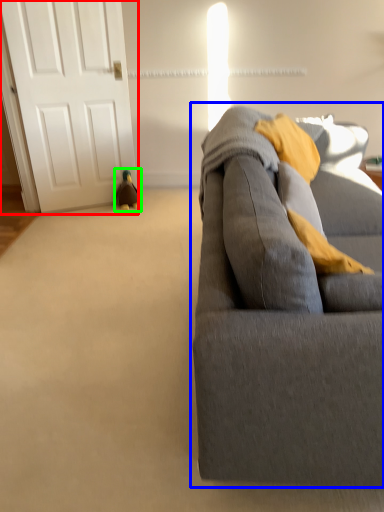
Question: Which is nearer to the door (highlighted by a red box)? studio couch (highlighted by a blue box) or toy (highlighted by a green box).

Choices:
 (A) studio couch
 (B) toy

Answer: (B)